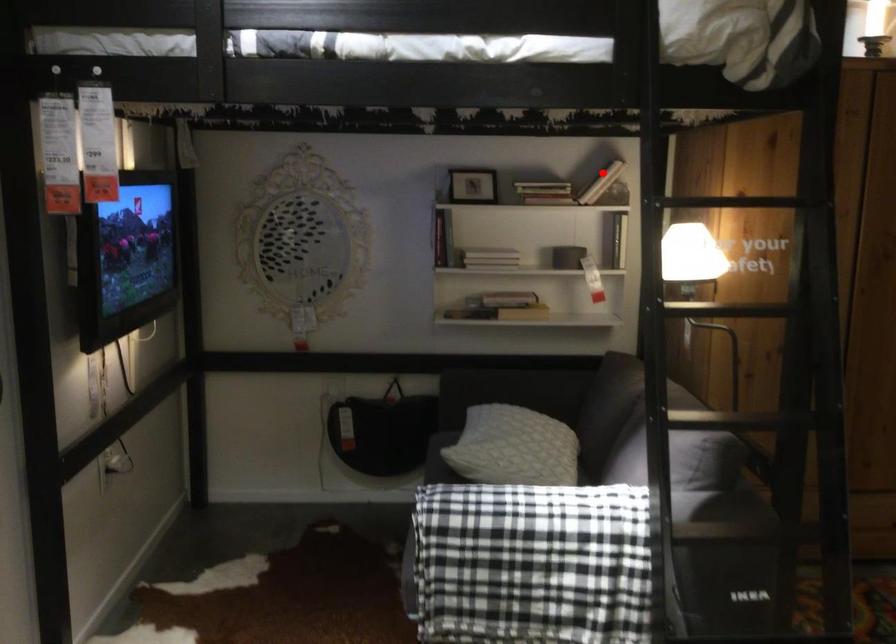
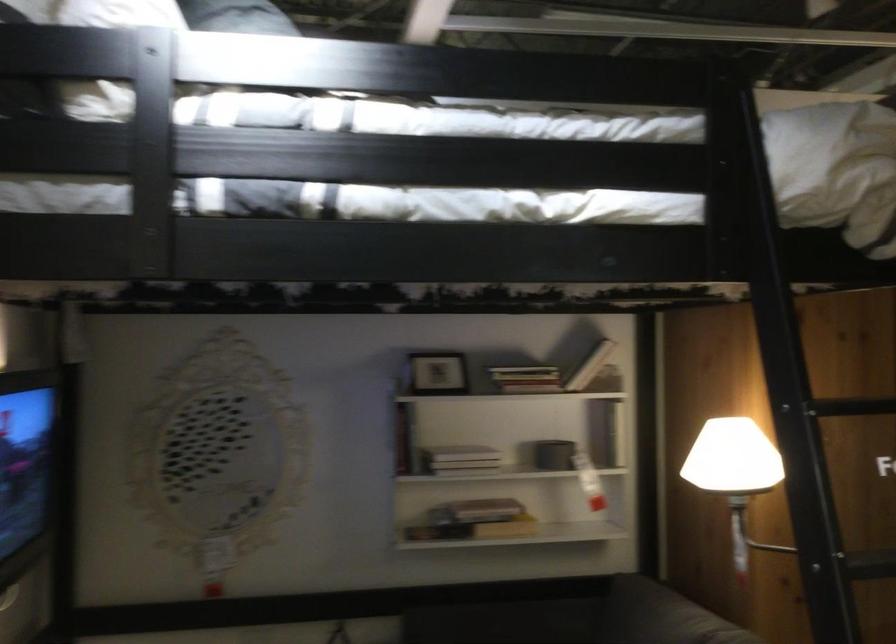
Question: I am providing you with two images of the same scene from different viewpoints. Image1 has a red point marked. In image2, the corresponding 3D location appears at what relative position? Reply with the corresponding letter.

Choices:
 (A) Closer
 (B) Farther

Answer: (A)